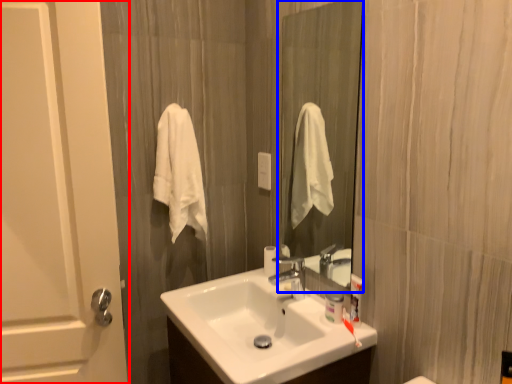
Question: Which object appears closest to the camera in this image, door (highlighted by a red box) or mirror (highlighted by a blue box)?

Choices:
 (A) door
 (B) mirror

Answer: (A)